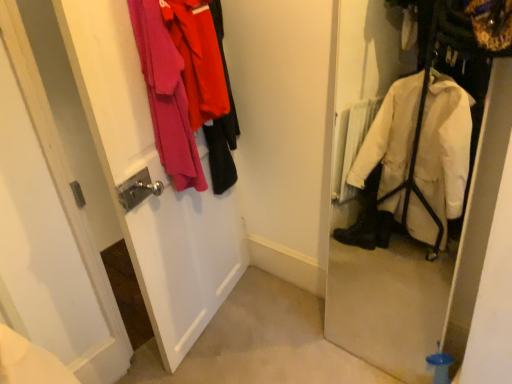
Question: From a real-world perspective, is velvet pink coat at left positioned above or below white matte door at left?

Choices:
 (A) below
 (B) above

Answer: (B)

Question: In terms of height, does velvet pink coat at left look taller or shorter compared to white matte door at left?

Choices:
 (A) short
 (B) tall

Answer: (A)

Question: In the image, is velvet pink coat at left on the left side or the right side of white matte door at left?

Choices:
 (A) right
 (B) left

Answer: (A)

Question: Is white matte door at left spatially inside velvet pink coat at left, or outside of it?

Choices:
 (A) inside
 (B) outside

Answer: (B)

Question: Is white matte door at left to the left or to the right of velvet pink coat at left in the image?

Choices:
 (A) left
 (B) right

Answer: (A)

Question: Is white matte door at left bigger or smaller than velvet pink coat at left?

Choices:
 (A) small
 (B) big

Answer: (B)

Question: From a real-world perspective, is white matte door at left physically located above or below velvet pink coat at left?

Choices:
 (A) above
 (B) below

Answer: (B)